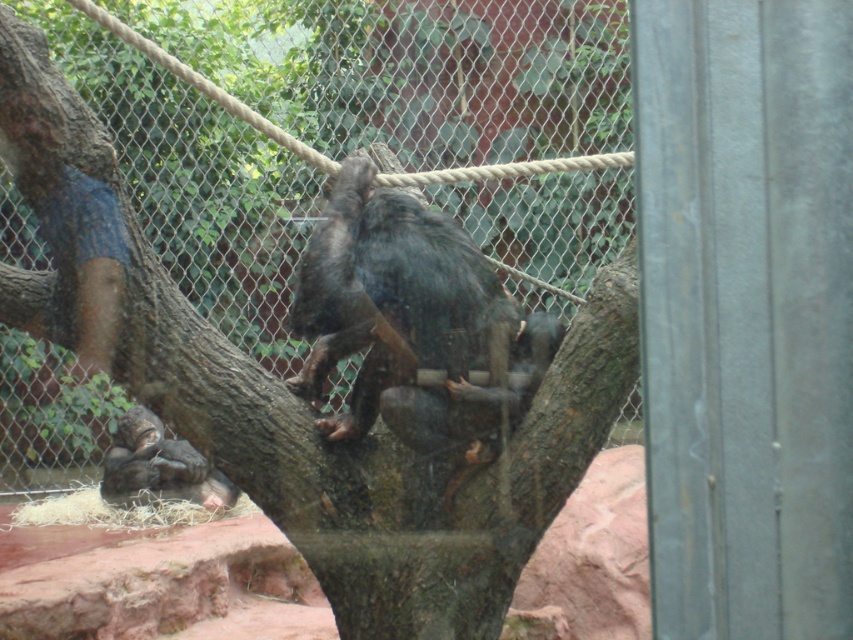
Between shiny black monkey at center and dark gray fur monkey at lower left, which one appears on the right side from the viewer's perspective?

shiny black monkey at center

Is shiny black monkey at center to the right of dark gray fur monkey at lower left from the viewer's perspective?

Correct, you'll find shiny black monkey at center to the right of dark gray fur monkey at lower left.

The width and height of the screenshot is (853, 640). In order to click on shiny black monkey at center in this screenshot , I will do `click(412, 323)`.

The width and height of the screenshot is (853, 640). Identify the location of shiny black monkey at center. (412, 323).